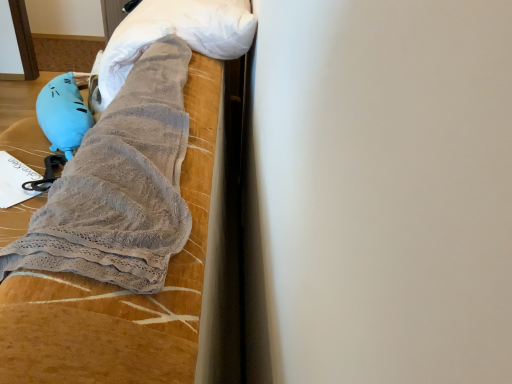
Locate an element on the screen. The width and height of the screenshot is (512, 384). gray fuzzy towel at upper center is located at coordinates (173, 33).

The image size is (512, 384). What do you see at coordinates (118, 286) in the screenshot? I see `velvet-like fabric bedspread at upper left` at bounding box center [118, 286].

What do you see at coordinates (64, 112) in the screenshot?
I see `matte blue plush at left` at bounding box center [64, 112].

At what (x,y) coordinates should I click in order to perform the action: click on gray fuzzy towel at upper center. Please return your answer as a coordinate pair (x, y). Looking at the image, I should click on [173, 33].

Would you consider velvet-like fabric bedspread at upper left to be distant from matte blue plush at left?

No.

Based on the photo, is velvet-like fabric bedspread at upper left positioned before matte blue plush at left?

Yes.

Considering the positions of objects velvet-like fabric bedspread at upper left and matte blue plush at left in the image provided, who is more to the left, velvet-like fabric bedspread at upper left or matte blue plush at left?

Positioned to the left is matte blue plush at left.

Considering the points (172, 166) and (41, 101), which point is behind, point (172, 166) or point (41, 101)?

The point (41, 101) is farther from the camera.

Is velvet-like fabric bedspread at upper left to the left of gray fuzzy towel at upper center from the viewer's perspective?

Indeed, velvet-like fabric bedspread at upper left is positioned on the left side of gray fuzzy towel at upper center.

Consider the image. From the image's perspective, is velvet-like fabric bedspread at upper left above or below gray fuzzy towel at upper center?

velvet-like fabric bedspread at upper left is below gray fuzzy towel at upper center.

Are velvet-like fabric bedspread at upper left and gray fuzzy towel at upper center beside each other?

velvet-like fabric bedspread at upper left and gray fuzzy towel at upper center are not in contact.

How far apart are matte blue plush at left and velvet-like fabric bedspread at upper left?

matte blue plush at left is 34.50 inches away from velvet-like fabric bedspread at upper left.

Does matte blue plush at left come in front of velvet-like fabric bedspread at upper left?

No.

Can you confirm if matte blue plush at left is shorter than velvet-like fabric bedspread at upper left?

Indeed, matte blue plush at left has a lesser height compared to velvet-like fabric bedspread at upper left.

Find the location of a particular element. The width and height of the screenshot is (512, 384). toy behind the velvet-like fabric bedspread at upper left is located at coordinates (64, 112).

Considering the relative sizes of gray fuzzy towel at upper center and matte blue plush at left in the image provided, is gray fuzzy towel at upper center shorter than matte blue plush at left?

Incorrect, the height of gray fuzzy towel at upper center does not fall short of that of matte blue plush at left.

Considering the sizes of objects gray fuzzy towel at upper center and matte blue plush at left in the image provided, who is thinner, gray fuzzy towel at upper center or matte blue plush at left?

Thinner between the two is matte blue plush at left.

Based on the photo, considering the sizes of objects gray fuzzy towel at upper center and matte blue plush at left in the image provided, who is bigger, gray fuzzy towel at upper center or matte blue plush at left?

With larger size is gray fuzzy towel at upper center.

Is matte blue plush at left turned away from gray fuzzy towel at upper center?

No, gray fuzzy towel at upper center is not at the back of matte blue plush at left.

Is point (78, 83) more distant than point (149, 23)?

Yes, it is.

From the picture: Considering the relative sizes of matte blue plush at left and gray fuzzy towel at upper center in the image provided, is matte blue plush at left smaller than gray fuzzy towel at upper center?

Correct, matte blue plush at left occupies less space than gray fuzzy towel at upper center.

Is matte blue plush at left wider or thinner than gray fuzzy towel at upper center?

In the image, matte blue plush at left appears to be more narrow than gray fuzzy towel at upper center.

Is point (245, 38) closer or farther from the camera than point (193, 197)?

Point (245, 38) appears to be farther away from the viewer than point (193, 197).

From a real-world perspective, which object rests below the other?

velvet-like fabric bedspread at upper left, from a real-world perspective.

Would you consider gray fuzzy towel at upper center to be distant from velvet-like fabric bedspread at upper left?

No.

Measure the distance between gray fuzzy towel at upper center and velvet-like fabric bedspread at upper left.

gray fuzzy towel at upper center and velvet-like fabric bedspread at upper left are 8.62 inches apart.

Identify the location of furniture below the matte blue plush at left (from a real-world perspective). The image size is (512, 384). (118, 286).

Find the location of a particular element. wrap above the velvet-like fabric bedspread at upper left (from the image's perspective) is located at coordinates (173, 33).

When comparing their distances from velvet-like fabric bedspread at upper left, does matte blue plush at left or gray fuzzy towel at upper center seem further?

Among the two, matte blue plush at left is located further to velvet-like fabric bedspread at upper left.

Estimate the real-world distances between objects in this image. Which object is closer to gray fuzzy towel at upper center, velvet-like fabric bedspread at upper left or matte blue plush at left?

Based on the image, velvet-like fabric bedspread at upper left appears to be nearer to gray fuzzy towel at upper center.

Considering their positions, is velvet-like fabric bedspread at upper left positioned further to matte blue plush at left than gray fuzzy towel at upper center?

Among the two, velvet-like fabric bedspread at upper left is located further to matte blue plush at left.

Based on their spatial positions, is gray fuzzy towel at upper center or velvet-like fabric bedspread at upper left closer to matte blue plush at left?

gray fuzzy towel at upper center is closer to matte blue plush at left.

Based on their spatial positions, is gray fuzzy towel at upper center or matte blue plush at left closer to velvet-like fabric bedspread at upper left?

Based on the image, gray fuzzy towel at upper center appears to be nearer to velvet-like fabric bedspread at upper left.

When comparing their distances from gray fuzzy towel at upper center, does matte blue plush at left or velvet-like fabric bedspread at upper left seem further?

Among the two, matte blue plush at left is located further to gray fuzzy towel at upper center.

You are a GUI agent. You are given a task and a screenshot of the screen. Output one action in this format:
    pyautogui.click(x=<x>, y=<y>)
    Task: Click on the wrap between velvet-like fabric bedspread at upper left and matte blue plush at left along the z-axis
    
    Given the screenshot: What is the action you would take?
    pyautogui.click(x=173, y=33)